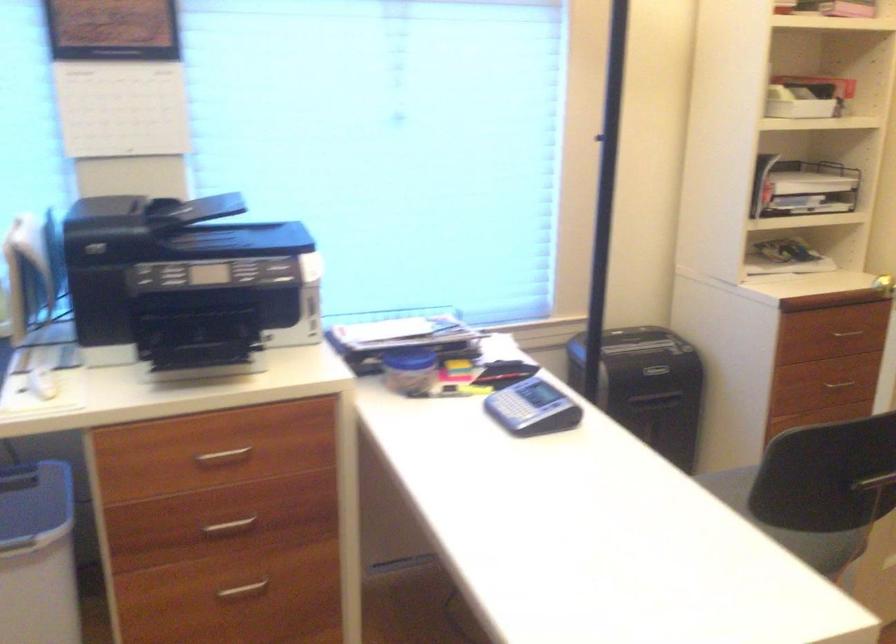
The image size is (896, 644). Identify the location of shredder bin. (647, 386).